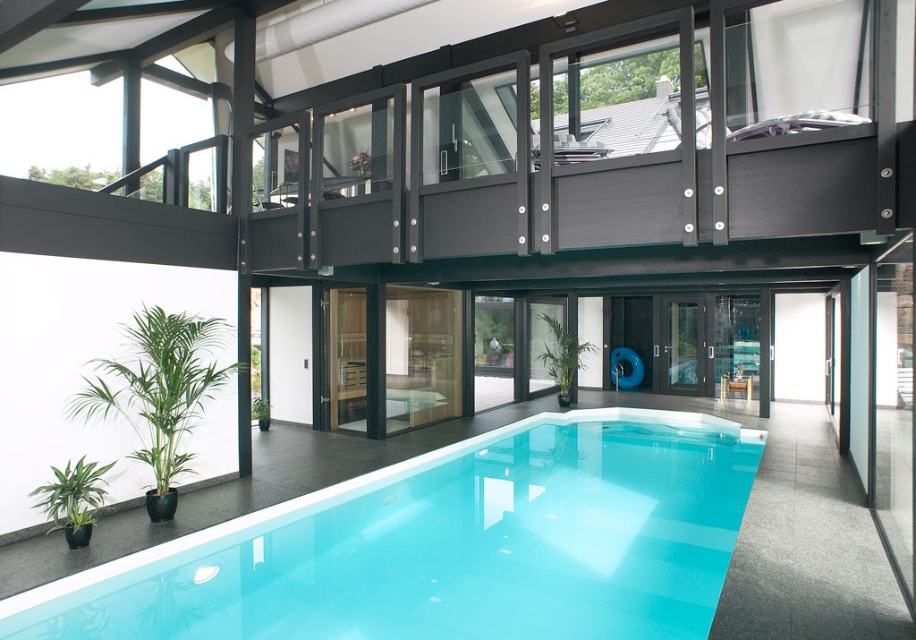
Question: Is clear acrylic pool at lower center wider than green glossy plant at lower left?

Choices:
 (A) yes
 (B) no

Answer: (A)

Question: Among these points, which one is nearest to the camera?

Choices:
 (A) (195, 388)
 (B) (311, 502)
 (C) (83, 500)
 (D) (552, 353)

Answer: (C)

Question: Which object appears farthest from the camera in this image?

Choices:
 (A) green glossy plant at lower left
 (B) green glossy plant at center

Answer: (B)

Question: Which of the following is the farthest from the observer?

Choices:
 (A) pos(543,344)
 (B) pos(80,515)

Answer: (A)

Question: Does green leafy plant at lower left appear under green glossy plant at center?

Choices:
 (A) yes
 (B) no

Answer: (B)

Question: Does clear acrylic pool at lower center come behind green glossy plant at center?

Choices:
 (A) yes
 (B) no

Answer: (B)